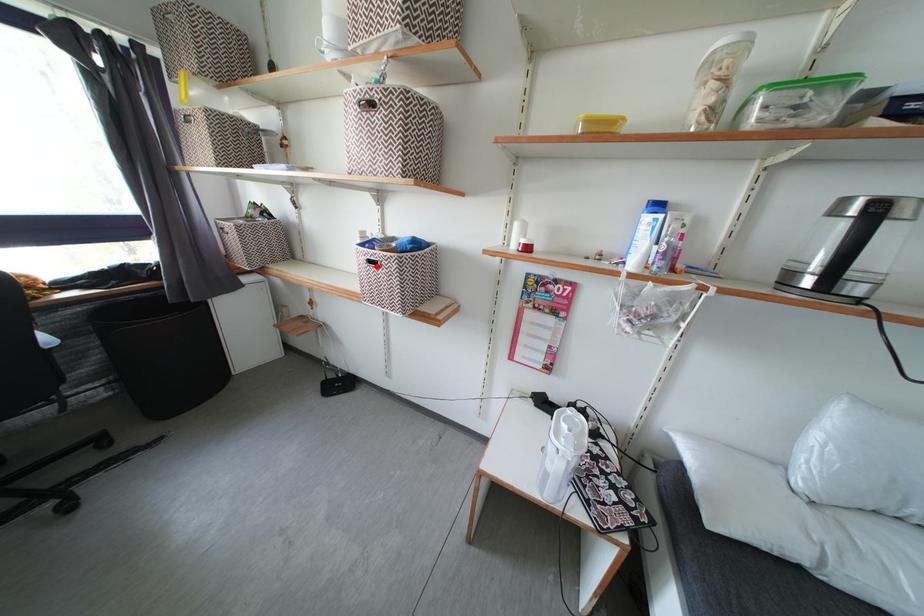
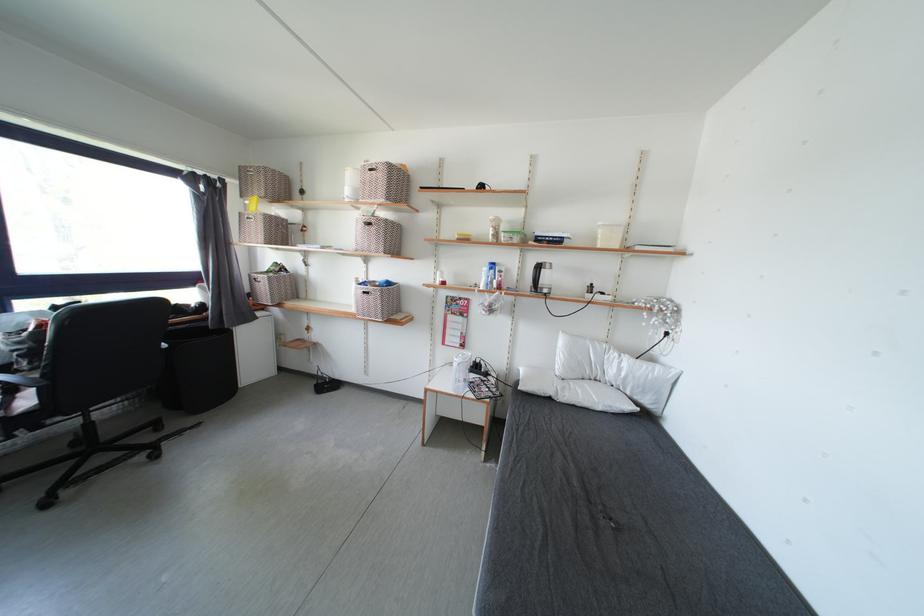
Question: I am providing you with two images of the same scene from different viewpoints. Image1 has a red point marked. In image2, the corresponding 3D location appears at what relative position? Reply with the corresponding letter.

Choices:
 (A) Closer
 (B) Farther

Answer: (A)